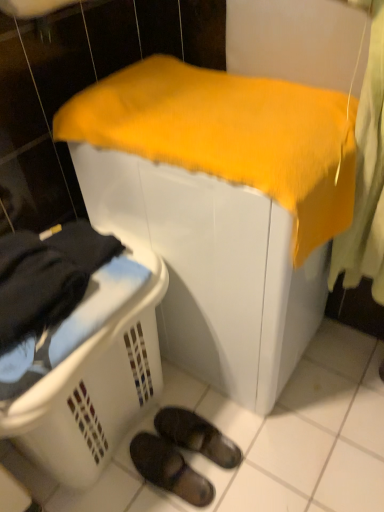
This screenshot has height=512, width=384. What are the coordinates of `vacant space to the right of black suede slippers at lower center, which is counted as the first footwear, starting from the top` in the screenshot? It's located at (258, 444).